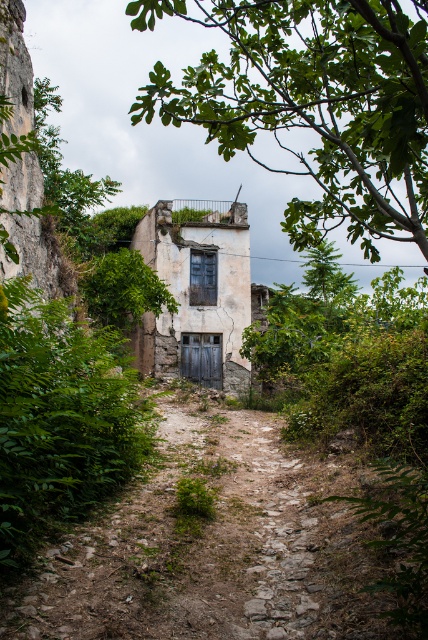
Between green leafy tree at upper center and weathered stone building at center, which one has less height?

With less height is weathered stone building at center.

Is green leafy tree at upper center bigger than weathered stone building at center?

Yes, green leafy tree at upper center is bigger than weathered stone building at center.

Is point (350, 179) positioned behind point (196, 358)?

No, (350, 179) is closer to viewer.

At what (x,y) coordinates should I click in order to perform the action: click on green leafy tree at upper center. Please return your answer as a coordinate pair (x, y). This screenshot has height=640, width=428. Looking at the image, I should click on (312, 104).

Is green leafy bush at center to the left of weathered stone building at center from the viewer's perspective?

Incorrect, green leafy bush at center is not on the left side of weathered stone building at center.

Can you confirm if green leafy bush at center is positioned below weathered stone building at center?

Indeed, green leafy bush at center is positioned under weathered stone building at center.

Measure the distance between point [122,435] and camera.

A distance of 8.08 meters exists between point [122,435] and camera.

You are a GUI agent. You are given a task and a screenshot of the screen. Output one action in this format:
    pyautogui.click(x=<x>, y=<y>)
    Task: Click on the green leafy bush at center
    This screenshot has width=428, height=640.
    Given the screenshot: What is the action you would take?
    pyautogui.click(x=59, y=417)

Who is positioned more to the left, green leafy tree at upper center or green leafy bush at center?

green leafy bush at center is more to the left.

Between point (229, 81) and point (41, 452), which one is positioned in front?

Positioned in front is point (41, 452).

At what (x,y) coordinates should I click in order to perform the action: click on green leafy tree at upper center. Please return your answer as a coordinate pair (x, y). The width and height of the screenshot is (428, 640). Looking at the image, I should click on (312, 104).

The height and width of the screenshot is (640, 428). Find the location of `green leafy tree at upper center`. green leafy tree at upper center is located at coordinates point(312,104).